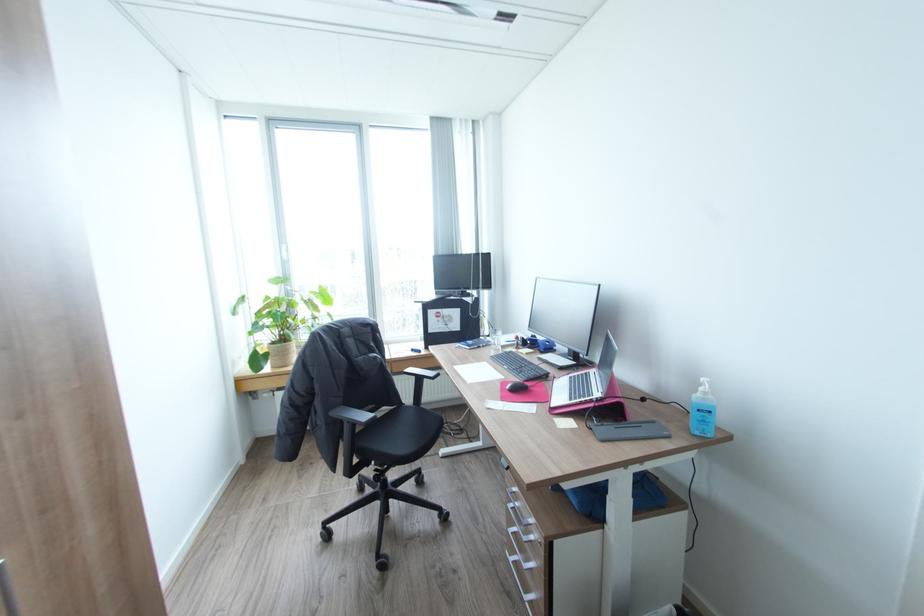
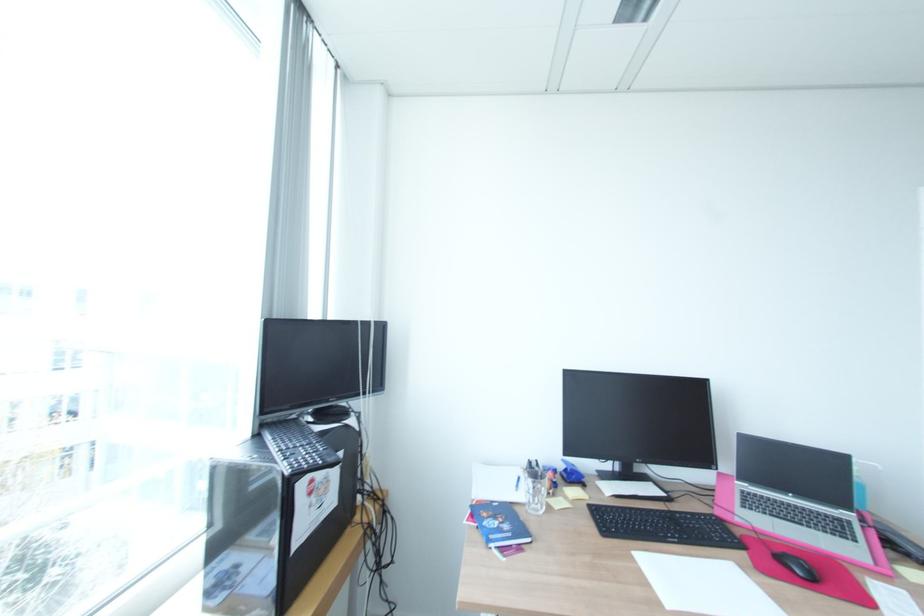
In the second image, find the point that corresponds to point 487,253 in the first image.

(381, 321)